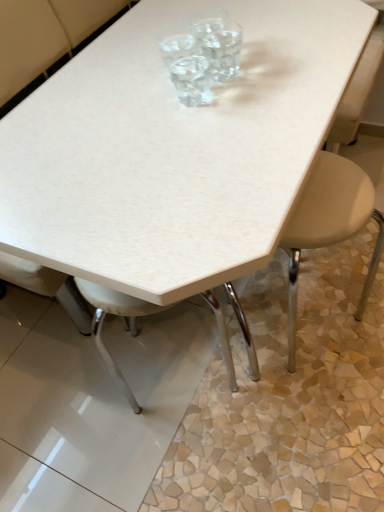
Locate an element on the screen. The image size is (384, 512). free point below beige plastic chair at lower right (from a real-world perspective) is located at coordinates (329, 361).